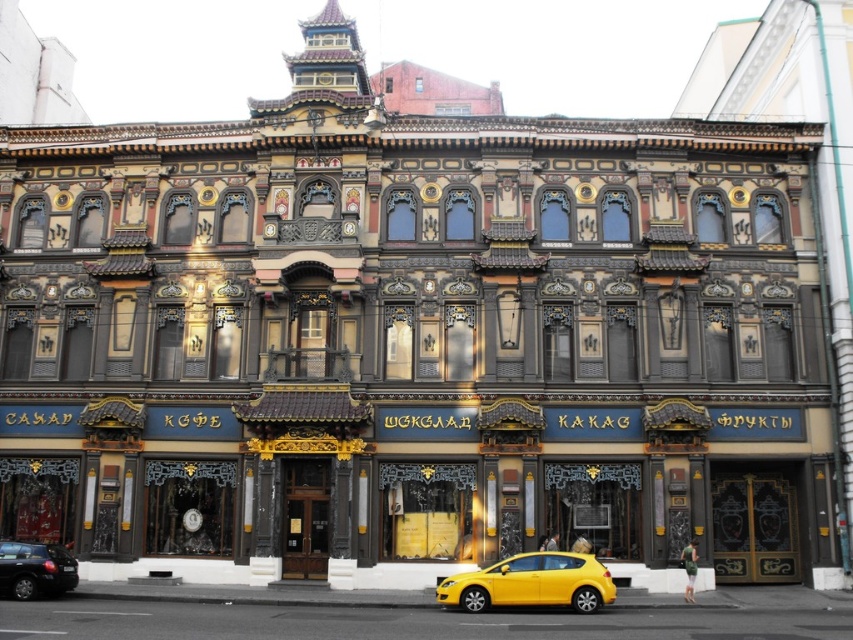
You are standing in front of the ornate building and want to park your metallic yellow car at lower center. The parking spot is located at coordinate point 0.912, 0.624. Is your car already parked in the correct spot?

Yes, the metallic yellow car at lower center is already parked at the correct coordinate point (531, 582).

You are a delivery driver who needs to park your truck, which is 6 meters long, in front of the building. The parking spot between the metallic yellow car at lower center and the black matte car at lower left is available. Can your truck fit in that spot?

The metallic yellow car at lower center is larger than the black matte car at lower left, but the exact dimensions of the parking spot aren

You are a delivery person trying to park your van in front of the building. There are two cars blocking the path, a metallic yellow car at lower center and a black matte car at lower left. Which car is directly above the other, and which one should you move first to access the parking spot?

The metallic yellow car at lower center is positioned under the black matte car at lower left. To access the parking spot, you should move the black matte car at lower left first, as it is blocking the path above the metallic yellow car at lower center.